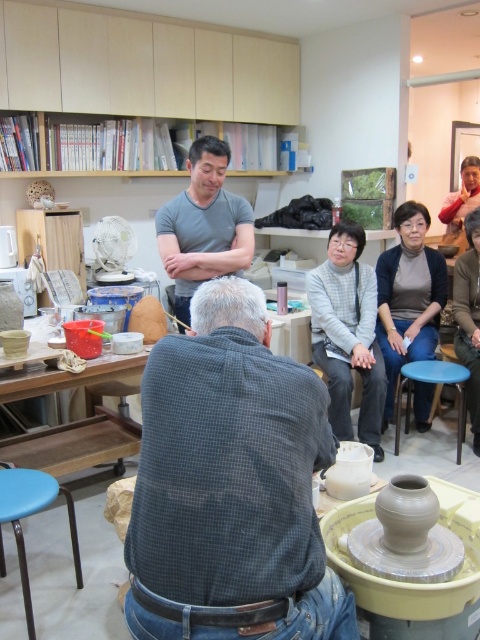
In the pottery workshop scene, there is a point labeled as point (230, 483). What object is located at this coordinate?

The point (230, 483) corresponds to the dark gray checkered shirt at center.

You are a photographer trying to capture a closeup shot of the gray cotton shirt at center and the blue plastic stool at lower center. Since you want to focus on both objects equally, would you need to adjust your camera settings to account for their sizes?

The gray cotton shirt at center has a lesser width compared to blue plastic stool at lower center. To focus on both equally, adjust the camera settings to ensure the smaller gray cotton shirt at center is properly in focus alongside the larger blue plastic stool at lower center.

You are a photographer in the pottery workshop. You need to take a photo of the gray cotton shirt at center and the blue plastic stool at lower center. Which object is positioned higher in the image?

The gray cotton shirt at center is located above the blue plastic stool at lower center, so it is positioned higher in the image.